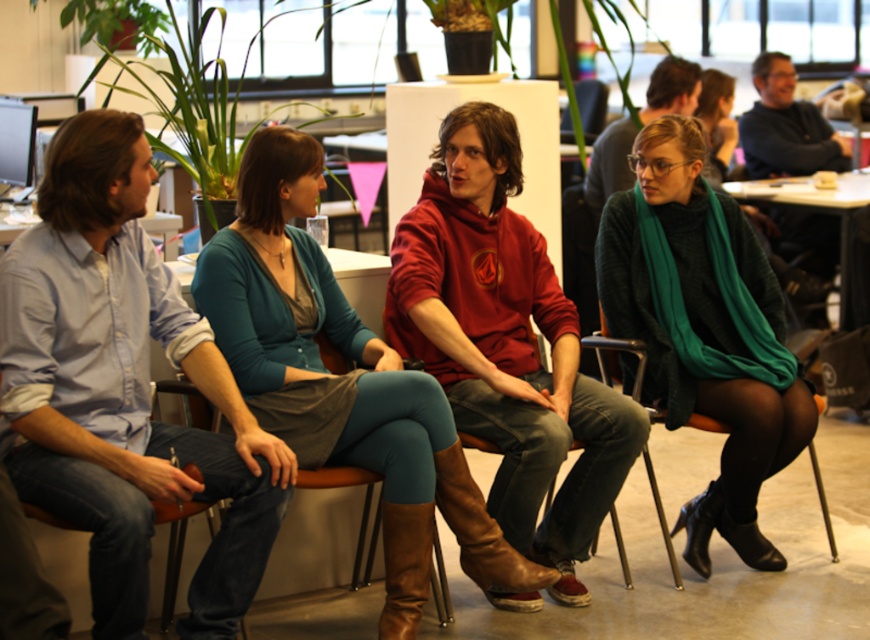
You are a photographer standing at the back of the room. You want to take a photo of the red hoodie at center and teal fabric skirt at center so that both are clearly visible in the frame. Given that your camera has a minimum focus distance of 18 inches, will you need to step forward or backward to ensure both subjects are in focus?

The distance between the red hoodie at center and teal fabric skirt at center is 17.87 inches, which is slightly less than the camera minimum focus distance of 18 inches. Therefore, you should step forward a little to reduce the distance between the subjects so they can both be in focus.

In the scene where four people are sitting in an office space with large windows and potted plants, there is a red hoodie at center and a teal fabric skirt at center. Which of these two items is positioned to the right of the other?

The red hoodie at center is positioned to the right of the teal fabric skirt at center.